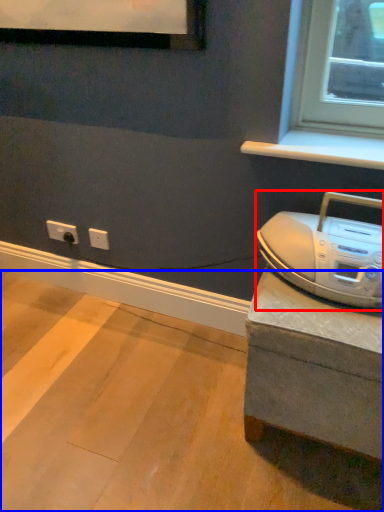
Question: Which point is closer to the camera, home appliance (highlighted by a red box) or concrete (highlighted by a blue box)?

Choices:
 (A) home appliance
 (B) concrete

Answer: (B)